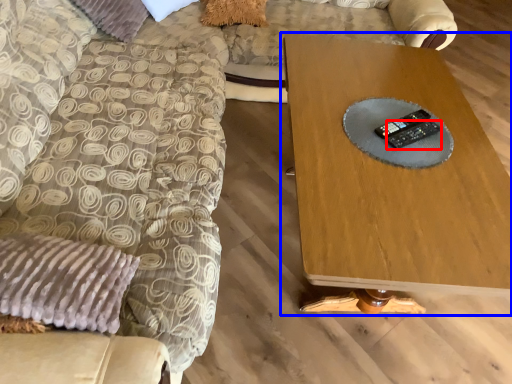
Question: Which of the following is the closest to the observer, control (highlighted by a red box) or table (highlighted by a blue box)?

Choices:
 (A) control
 (B) table

Answer: (B)